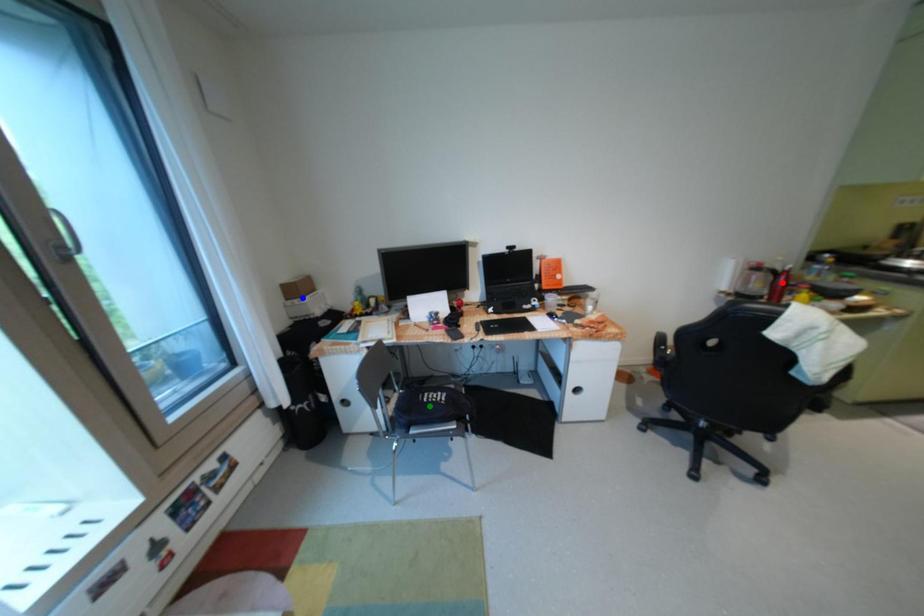
Order these from nearest to farthest:
red point, blue point, green point

green point
red point
blue point